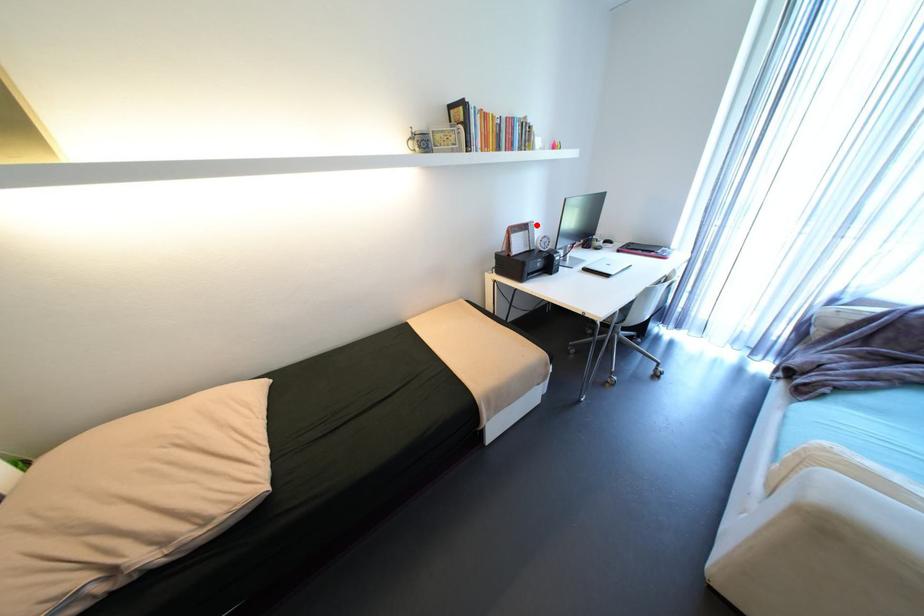
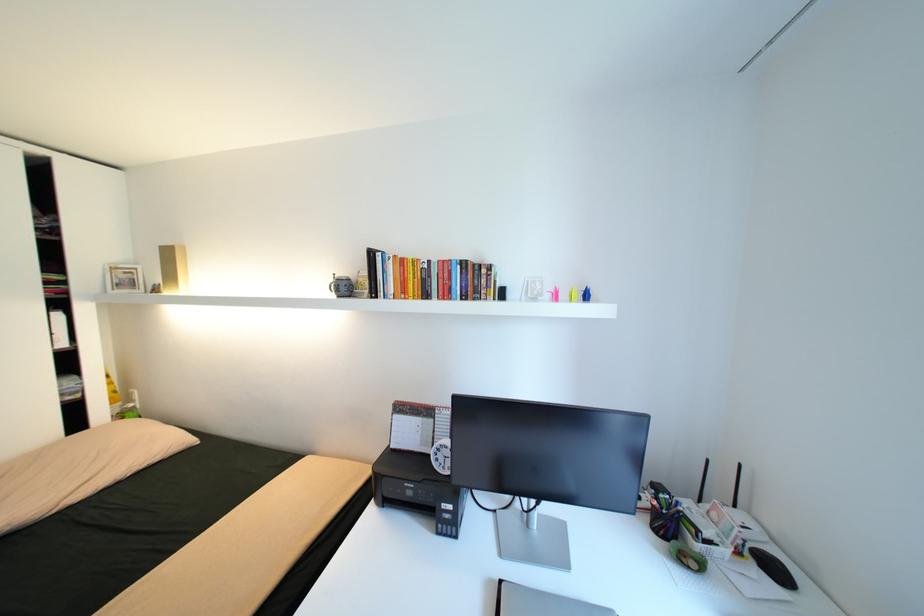
The point at the highlighted location is marked in the first image. Where is the corresponding point in the second image?

(444, 411)